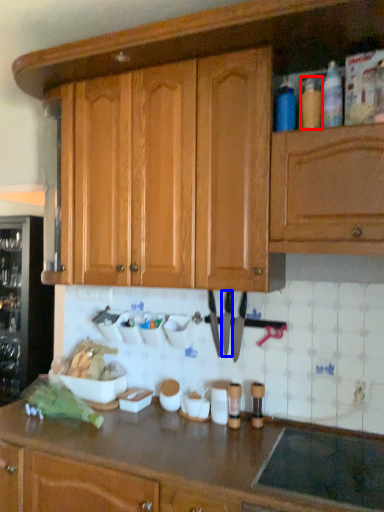
Question: Which of the following is the farthest to the observer, bottle (highlighted by a red box) or knife (highlighted by a blue box)?

Choices:
 (A) bottle
 (B) knife

Answer: (B)